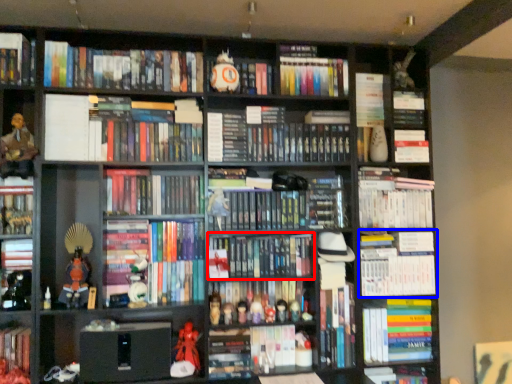
Question: Which of the following is the farthest to the observer, book (highlighted by a red box) or book (highlighted by a blue box)?

Choices:
 (A) book
 (B) book

Answer: (B)